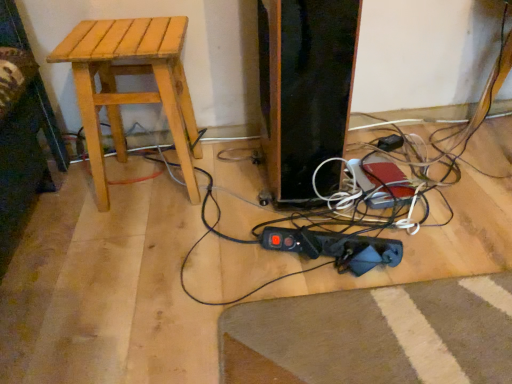
In order to face black plastic plug at lower right, should I rotate leftwards or rightwards?

It's best to rotate right around 17.291 degrees.

Describe the element at coordinates (390, 142) in the screenshot. I see `black plastic plug at lower right` at that location.

Where is `black plastic plug at lower right`? Image resolution: width=512 pixels, height=384 pixels. black plastic plug at lower right is located at coordinates (390, 142).

What do you see at coordinates (131, 92) in the screenshot? I see `light brown wood stool at left` at bounding box center [131, 92].

Where is `light brown wood stool at left`? light brown wood stool at left is located at coordinates (131, 92).

Identify the location of black plastic plug at lower right. This screenshot has height=384, width=512. (390, 142).

Is black plastic plug at lower right at the left side of light brown wood stool at left?

In fact, black plastic plug at lower right is to the right of light brown wood stool at left.

Considering their positions, is black plastic plug at lower right located in front of or behind light brown wood stool at left?

black plastic plug at lower right is behind light brown wood stool at left.

Considering the points (402, 138) and (175, 42), which point is in front, point (402, 138) or point (175, 42)?

The point (175, 42) is closer to the camera.

From the image's perspective, is black plastic plug at lower right positioned above or below light brown wood stool at left?

black plastic plug at lower right is situated lower than light brown wood stool at left in the image.

From a real-world perspective, relative to light brown wood stool at left, is black plastic plug at lower right vertically above or below?

black plastic plug at lower right is situated lower than light brown wood stool at left in the real world.

Looking at this image, is black plastic plug at lower right wider or thinner than light brown wood stool at left?

Considering their sizes, black plastic plug at lower right looks slimmer than light brown wood stool at left.

Can you confirm if black plastic plug at lower right is shorter than light brown wood stool at left?

Correct, black plastic plug at lower right is not as tall as light brown wood stool at left.

Does black plastic plug at lower right have a smaller size compared to light brown wood stool at left?

Correct, black plastic plug at lower right occupies less space than light brown wood stool at left.

From the picture: Would you say light brown wood stool at left is part of black plastic plug at lower right's contents?

That's incorrect, light brown wood stool at left is not inside black plastic plug at lower right.

Is black plastic plug at lower right positioned far away from light brown wood stool at left?

No, black plastic plug at lower right is in close proximity to light brown wood stool at left.

Is black plastic plug at lower right facing towards light brown wood stool at left?

No, black plastic plug at lower right does not turn towards light brown wood stool at left.

Measure the distance from black plastic plug at lower right to light brown wood stool at left.

black plastic plug at lower right and light brown wood stool at left are 32.67 inches apart.

The image size is (512, 384). In order to click on stool above the black plastic plug at lower right (from a real-world perspective) in this screenshot , I will do `click(131, 92)`.

Considering the positions of objects light brown wood stool at left and black plastic plug at lower right in the image provided, who is more to the right, light brown wood stool at left or black plastic plug at lower right?

From the viewer's perspective, black plastic plug at lower right appears more on the right side.

Based on the photo, is the depth of light brown wood stool at left greater than that of black plastic plug at lower right?

No, it is not.

Does point (124, 69) come farther from viewer compared to point (391, 137)?

No.

From the image's perspective, between light brown wood stool at left and black plastic plug at lower right, who is located below?

black plastic plug at lower right is shown below in the image.

From a real-world perspective, is light brown wood stool at left below black plastic plug at lower right?

Incorrect, from a real-world perspective, light brown wood stool at left is higher than black plastic plug at lower right.

Can you confirm if light brown wood stool at left is wider than black plastic plug at lower right?

Correct, the width of light brown wood stool at left exceeds that of black plastic plug at lower right.

In the scene shown: Between light brown wood stool at left and black plastic plug at lower right, which one has more height?

light brown wood stool at left.

Considering the sizes of light brown wood stool at left and black plastic plug at lower right in the image, is light brown wood stool at left bigger or smaller than black plastic plug at lower right?

light brown wood stool at left is bigger than black plastic plug at lower right.

Would you say light brown wood stool at left is outside black plastic plug at lower right?

light brown wood stool at left lies outside black plastic plug at lower right's area.

Would you say light brown wood stool at left is a long distance from black plastic plug at lower right?

They are positioned close to each other.

Could you tell me if light brown wood stool at left is turned towards black plastic plug at lower right?

No.

Can you tell me how much light brown wood stool at left and black plastic plug at lower right differ in facing direction?

They differ by 33.7 degrees in their facing directions.

The image size is (512, 384). Identify the location of plug below the light brown wood stool at left (from a real-world perspective). (390, 142).

This screenshot has height=384, width=512. Find the location of `plug behind the light brown wood stool at left`. plug behind the light brown wood stool at left is located at coordinates (390, 142).

The image size is (512, 384). What are the coordinates of `stool located on the left of black plastic plug at lower right` in the screenshot? It's located at (131, 92).